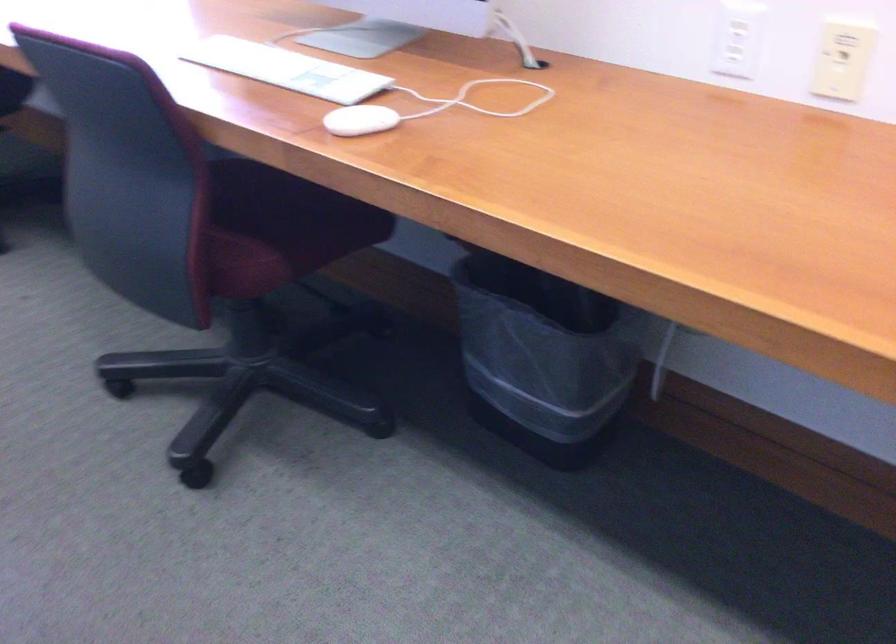
Where would you sit the chair sitting surface? Please return your answer as a coordinate pair (x, y).

(273, 228)